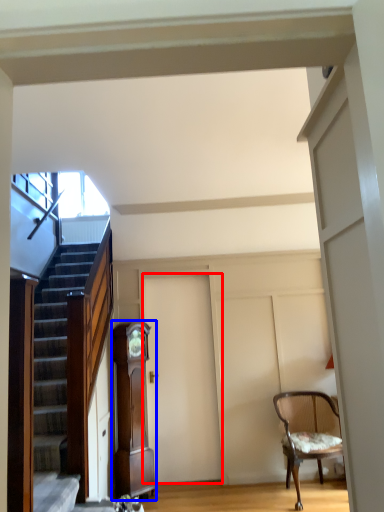
Question: Which of the following is the closest to the observer, door (highlighted by a red box) or cabinetry (highlighted by a blue box)?

Choices:
 (A) door
 (B) cabinetry

Answer: (B)